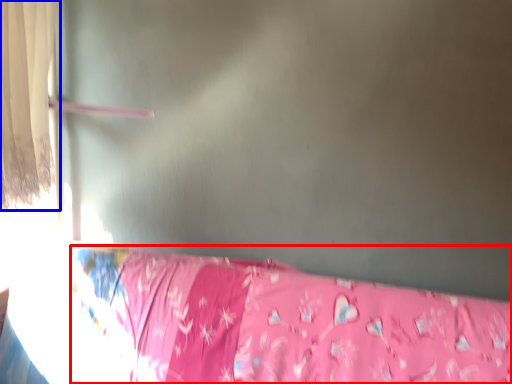
Question: Which object appears closest to the camera in this image, furniture (highlighted by a red box) or curtain (highlighted by a blue box)?

Choices:
 (A) furniture
 (B) curtain

Answer: (A)